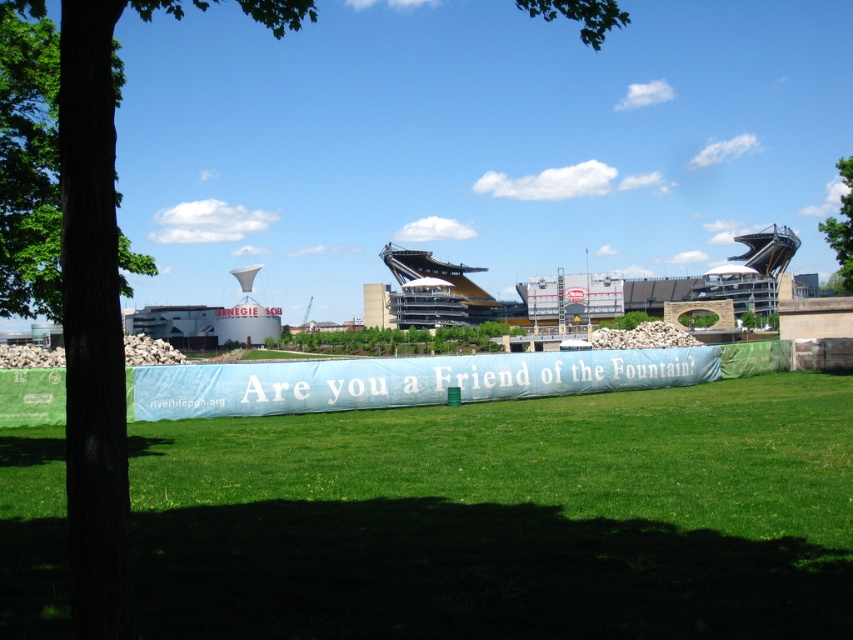
You are standing at point (399, 339). What do you see around you?

At point (399, 339), you see a green leafy tree at center.

What are the coordinates of the green leafy tree at center in the image?

The green leafy tree at center is located at coordinates (399,339).

You are planning to place a picnic blanket between the green rough bark tree at left and the green leafy tree at center. Which tree has a wider trunk to ensure enough space for the blanket?

The green leafy tree at center has a wider trunk than the green rough bark tree at left, so placing the picnic blanket there would provide more space.